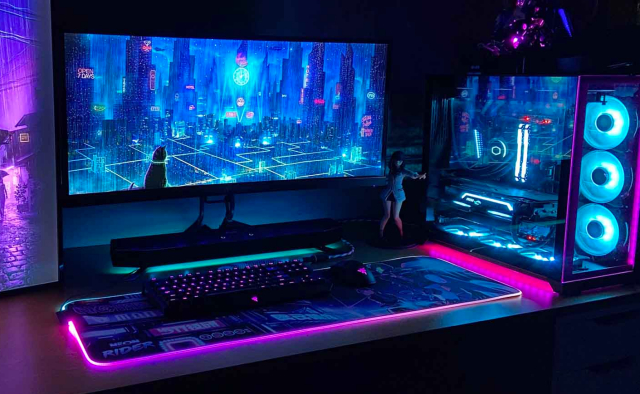
Identify the location of computer monitor stand. (221, 241).